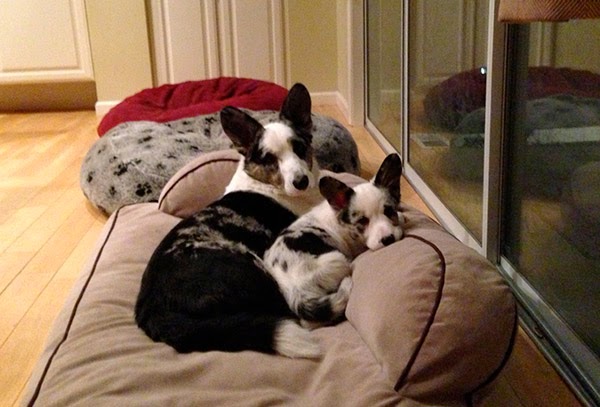
Find the location of a particular element. This screenshot has height=407, width=600. wall frame is located at coordinates (358, 96).